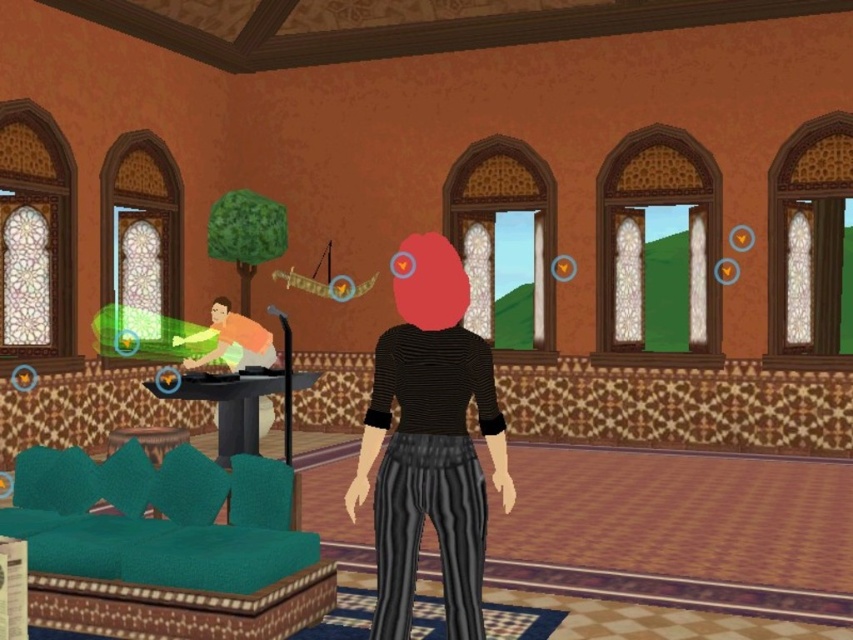
Question: Is teal fabric couch at lower left positioned before black glossy table at center?

Choices:
 (A) yes
 (B) no

Answer: (A)

Question: Which object is closer to the camera taking this photo?

Choices:
 (A) teal fabric couch at lower left
 (B) black striped pants at center
 (C) black glossy table at center

Answer: (B)

Question: Which object is the farthest from the black glossy table at center?

Choices:
 (A) black striped pants at center
 (B) teal fabric couch at lower left

Answer: (A)

Question: Does teal fabric couch at lower left appear over black striped pants at center?

Choices:
 (A) no
 (B) yes

Answer: (A)

Question: Can you confirm if teal fabric couch at lower left is wider than black striped pants at center?

Choices:
 (A) yes
 (B) no

Answer: (A)

Question: Which of the following is the farthest from the observer?

Choices:
 (A) (230, 419)
 (B) (213, 476)
 (C) (426, 500)

Answer: (A)